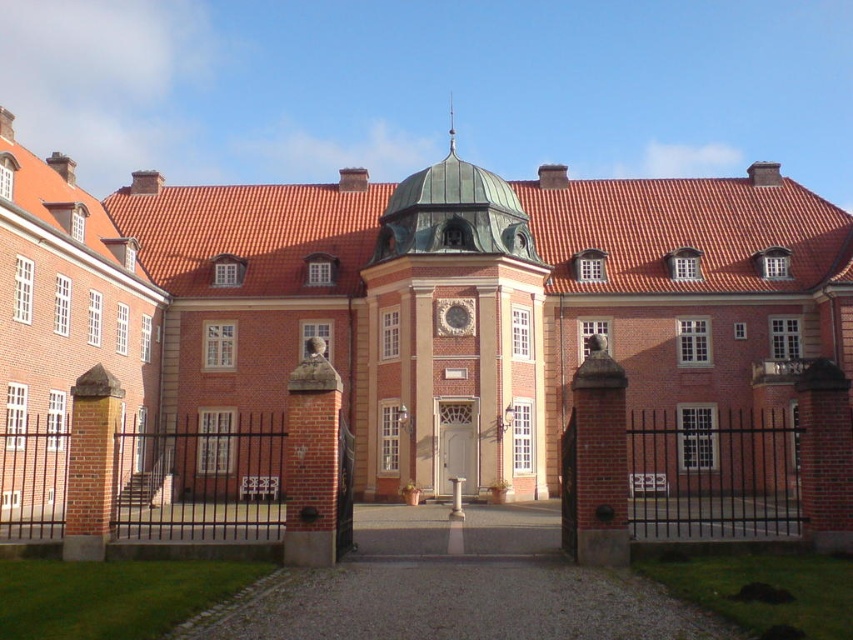
Does red brick building at center have a larger size compared to white wooden door at center?

Indeed, red brick building at center has a larger size compared to white wooden door at center.

Where is `red brick building at center`? red brick building at center is located at coordinates (395, 312).

Who is more forward, (51, 410) or (474, 406)?

Point (51, 410)

I want to click on red brick building at center, so click(x=395, y=312).